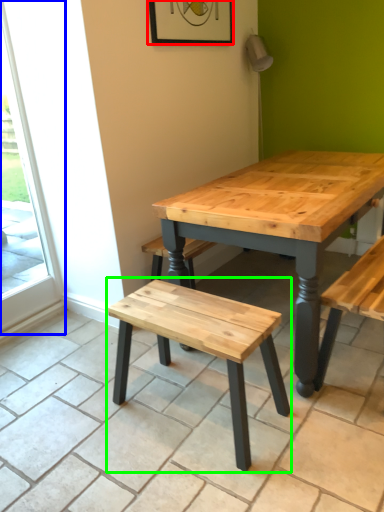
Question: Which is farther away from picture frame (highlighted by a red box)? screen door (highlighted by a blue box) or stool (highlighted by a green box)?

Choices:
 (A) screen door
 (B) stool

Answer: (B)